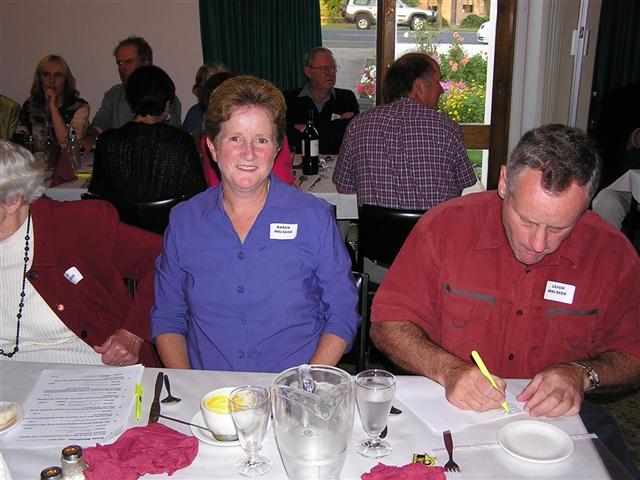
In order to click on drapes in this screenshot , I will do `click(256, 38)`.